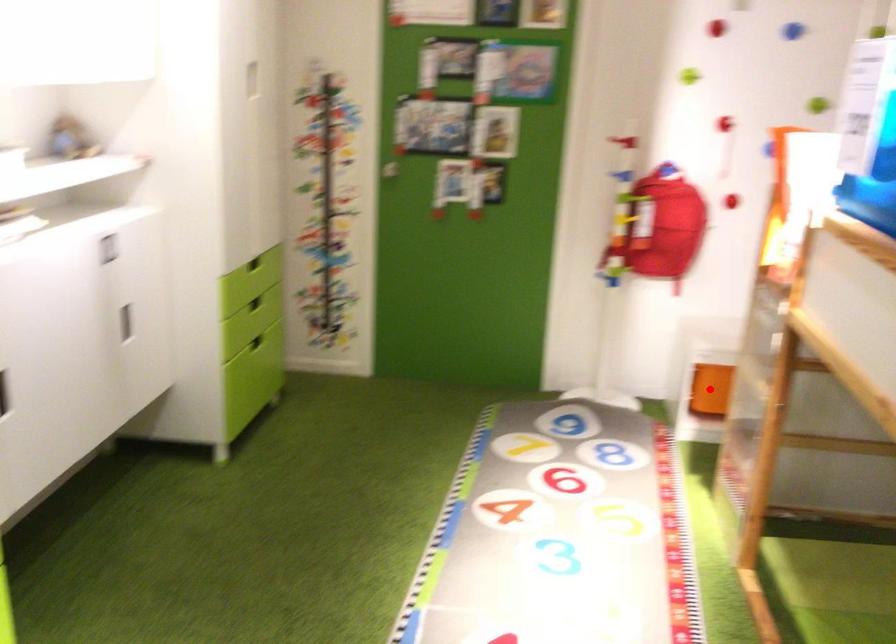
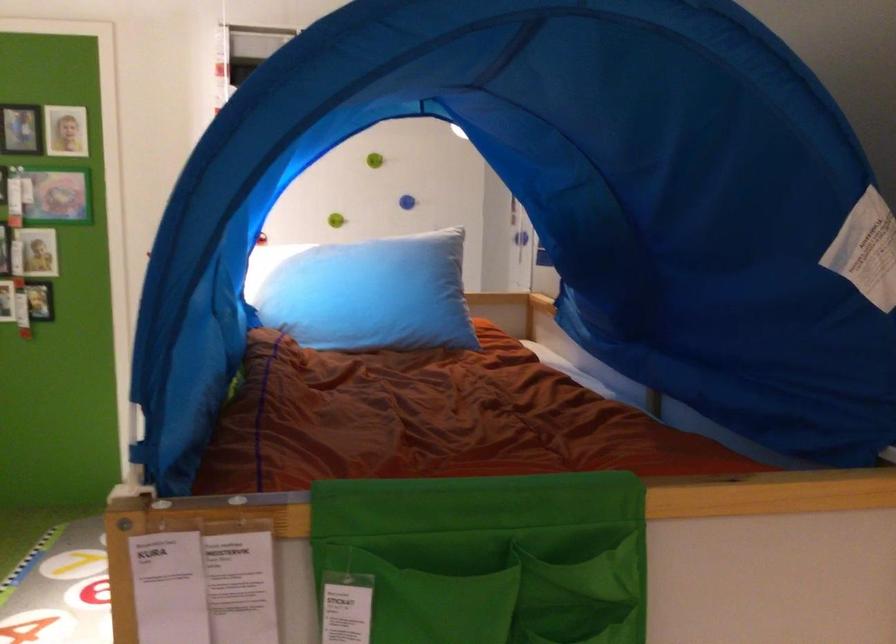
Question: I am providing you with two images of the same scene from different viewpoints. A red point is marked on the first image. Is the red point's position out of view in image 2?

Choices:
 (A) Yes
 (B) No

Answer: (A)